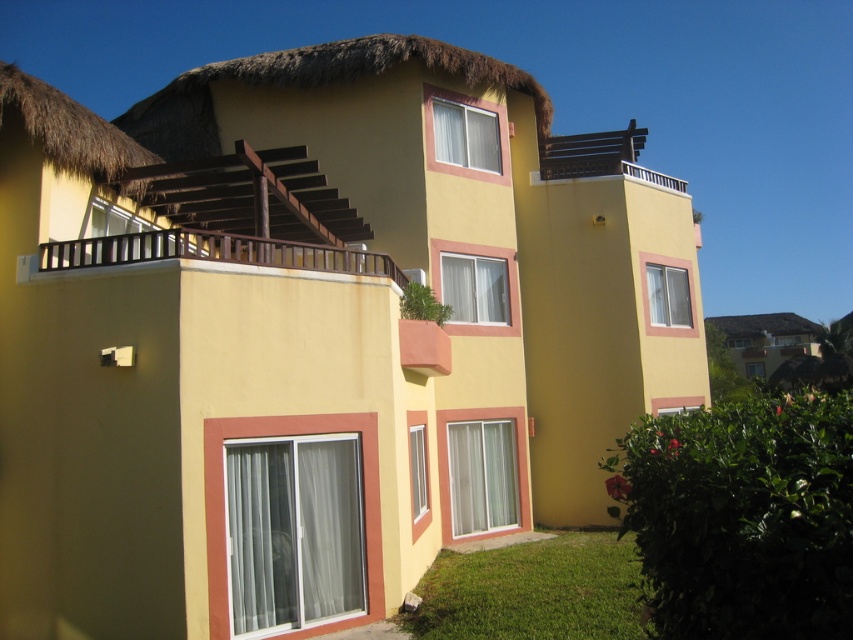
In the scene shown: Does wooden at upper left appear over white wooden balcony at upper center?

No, wooden at upper left is not above white wooden balcony at upper center.

Who is higher up, wooden at upper left or white wooden balcony at upper center?

white wooden balcony at upper center

You are a GUI agent. You are given a task and a screenshot of the screen. Output one action in this format:
    pyautogui.click(x=<x>, y=<y>)
    Task: Click on the wooden at upper left
    
    Given the screenshot: What is the action you would take?
    pyautogui.click(x=213, y=252)

Between point (764, 340) and point (587, 150), which one is positioned behind?

Point (764, 340)

Is thatched straw hut at upper right positioned at the back of white wooden balcony at upper center?

Yes.

The image size is (853, 640). I want to click on thatched straw hut at upper right, so click(759, 340).

Who is more forward, (97, 253) or (734, 365)?

Positioned in front is point (97, 253).

At what (x,y) coordinates should I click in order to perform the action: click on wooden at upper left. Please return your answer as a coordinate pair (x, y). Image resolution: width=853 pixels, height=640 pixels. Looking at the image, I should click on (213, 252).